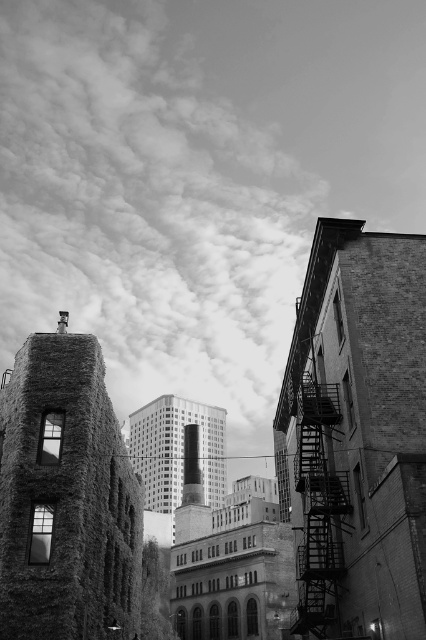
Looking at the cloudy sky at upper center and the metallic fire escape at right, which one covers a wider area in the image?

The cloudy sky at upper center covers a wider area in the image because its width is larger than that of the metallic fire escape at right.

You are an architect analyzing this urban scene. You need to determine which structure is shorter between the brick wall at right and the smooth concrete building at center based on their heights. Which one is shorter?

The brick wall at right is not as tall as the smooth concrete building at center, so the brick wall at right is shorter.

You are a photographer planning to capture a wide shot of the urban scene described. You want to ensure that both the cloudy sky at upper center and the rustic stone tower at left are visible in your frame. Based on their positions, which object should you prioritize keeping centered to avoid cropping either one?

The cloudy sky at upper center is positioned on the left side of rustic stone tower at left. To ensure both are visible without cropping, prioritize centering the rustic stone tower at left since the cloudy sky at upper center is already aligned to its left, allowing it to naturally fit within the frame.